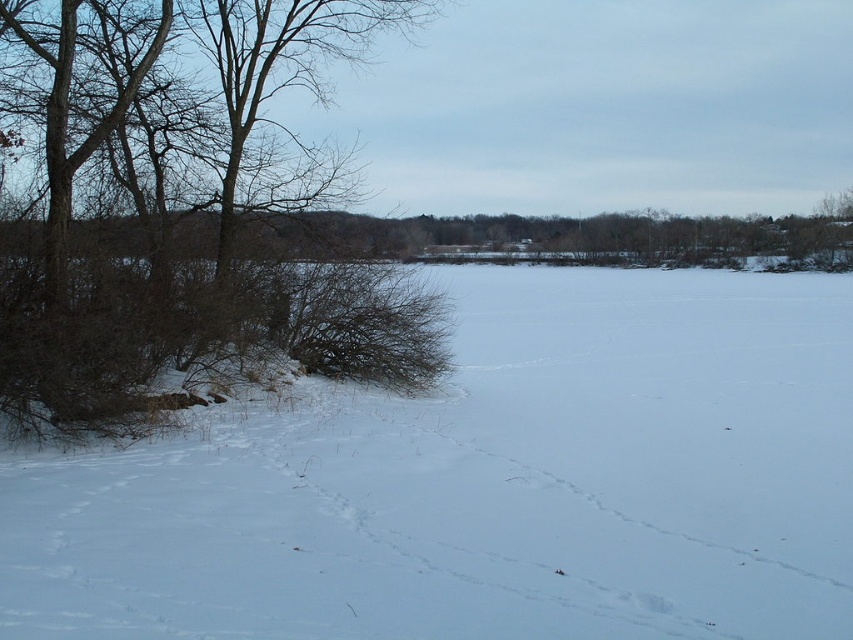
Is white powdery snow at lower left positioned in front of brown/dry wood at left?

Yes.

Is point (183, 468) farther from viewer compared to point (316, 168)?

That is False.

Locate an element on the screen. The image size is (853, 640). white powdery snow at lower left is located at coordinates (486, 483).